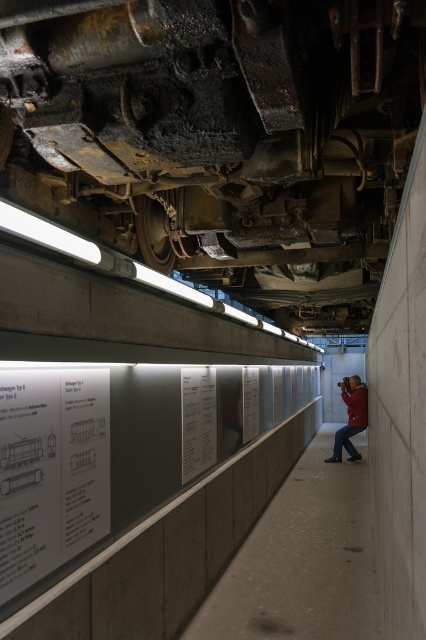
You are an art student who wants to examine the red leather jacket at center. However, there is a white paper poster at lower left blocking your view. Can you move the poster to get a better look at the jacket?

The white paper poster at lower left is positioned over the red leather jacket at center, so you can move the poster to reveal the jacket.

You are standing at the entrance of the corridor and want to take a photo of both point (25, 541) and point (198, 374) in the image. Since you want both points to be in focus, which point should you focus on first to ensure the other is also sharp?

You should focus on point (198, 374) first because it is farther from the camera than point (25, 541). By focusing on the farther point, the closer point will also be within the depth of field, ensuring both are sharp.

You are a museum guide standing in the corridor. You need to move a red leather jacket at center to the storage room located at the end of the corridor. The rusty metal train car at center is blocking the path. Can you move the jacket around the train car? Explain why or why not based on their sizes.

The rusty metal train car at center is wider than the red leather jacket at center. Since the train car is blocking the path and is wider, there might not be enough space to maneuver the jacket around it unless there is additional clearance on either side of the train car. However, given the narrow corridor described, it is likely challenging to move the jacket around the train car due to its larger width.